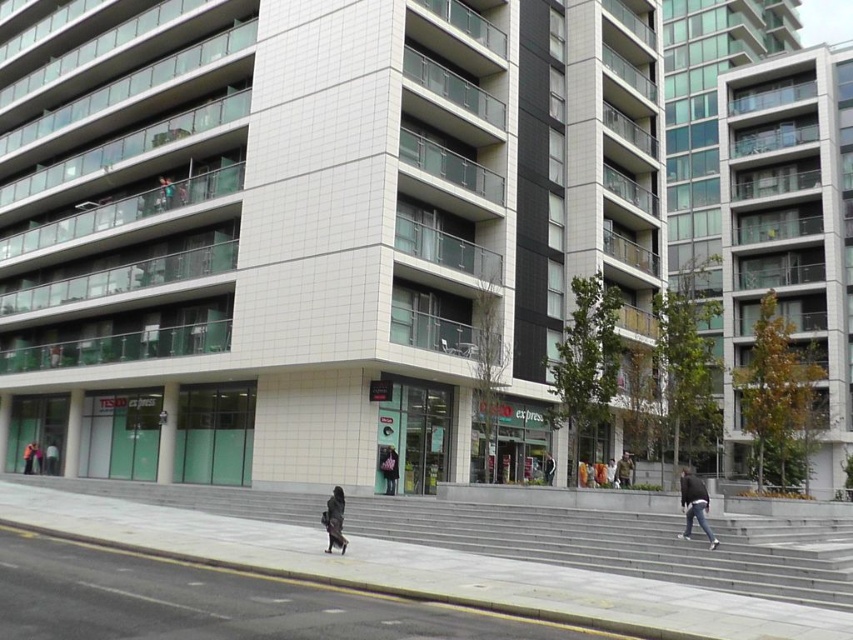
You are standing in front of the building and want to find the entrance to Tesco Express. Based on the coordinates provided in the scene description, where should you look relative to the gray concrete pavement at lower center?

The gray concrete pavement at lower center is located at coordinates point (215, 602). Since the Tesco Express entrance is on the ground floor in front of the building, you should look towards the lower part of the image near the gray concrete pavement at lower center to find the entrance.